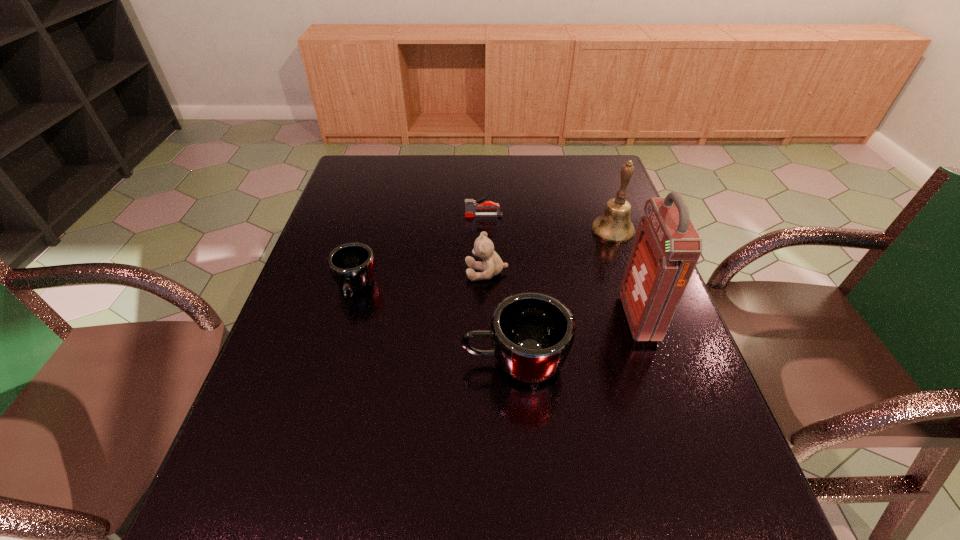
Image resolution: width=960 pixels, height=540 pixels. Find the location of `vacant region located 0.070m on the face of the teddy bear`. vacant region located 0.070m on the face of the teddy bear is located at coordinates (439, 272).

Identify the location of vacant space located 0.330m on the face of the teddy bear. The width and height of the screenshot is (960, 540). (339, 272).

At what (x,y) coordinates should I click in order to perform the action: click on object located at the left edge. Please return your answer as a coordinate pair (x, y). This screenshot has width=960, height=540. Looking at the image, I should click on (352, 265).

This screenshot has width=960, height=540. Identify the location of bell positioned at the right edge. (614, 225).

Identify the location of the first-aid kit that is at the right edge. (667, 246).

This screenshot has width=960, height=540. Find the location of `free space at the far edge`. free space at the far edge is located at coordinates (442, 155).

Where is `vacant space at the left edge`? This screenshot has width=960, height=540. vacant space at the left edge is located at coordinates (325, 406).

Identify the location of vacant space at the right edge of the desktop. Image resolution: width=960 pixels, height=540 pixels. (605, 258).

The height and width of the screenshot is (540, 960). Find the location of `vacant space at the far left corner`. vacant space at the far left corner is located at coordinates (387, 183).

Identify the location of vacant region at the near left corner of the desktop. The image size is (960, 540). (247, 467).